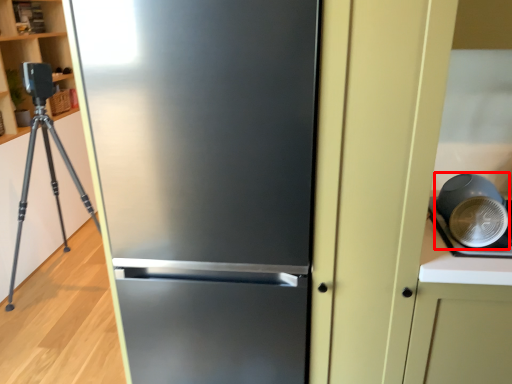
Question: From the image's perspective, where is appliance (annotated by the red box) located in relation to refrigerator in the image?

Choices:
 (A) above
 (B) below

Answer: (A)